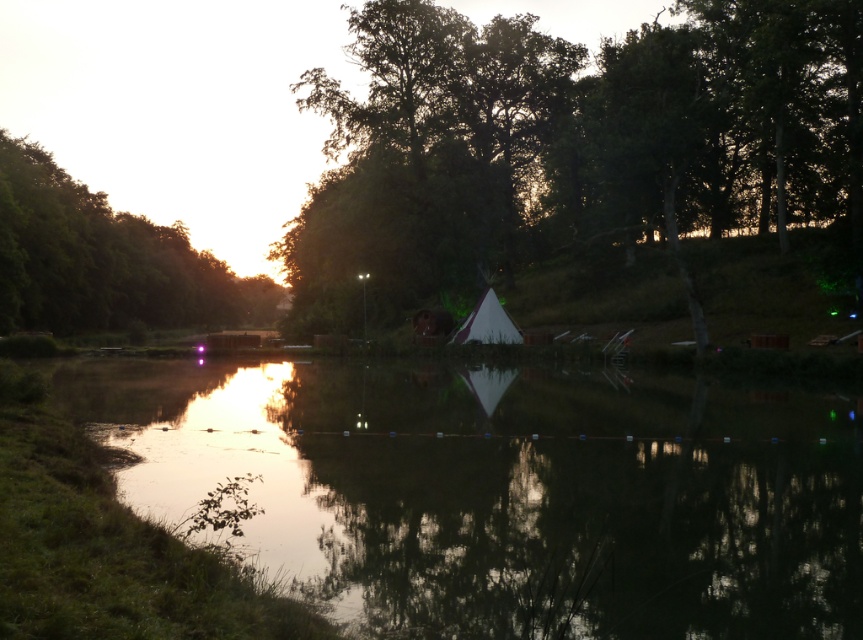
Is reflective glass water at center to the left of green leafy tree at upper left from the viewer's perspective?

In fact, reflective glass water at center is to the right of green leafy tree at upper left.

Looking at this image, can you confirm if reflective glass water at center is bigger than green leafy tree at upper left?

No, reflective glass water at center is not bigger than green leafy tree at upper left.

Is point (281, 481) positioned before point (213, 260)?

That is True.

Identify the location of reflective glass water at center. The image size is (863, 640). (501, 492).

Does reflective glass water at center have a lesser width compared to green leafy tree at center?

Correct, reflective glass water at center's width is less than green leafy tree at center's.

Find the location of a particular element. The width and height of the screenshot is (863, 640). reflective glass water at center is located at coordinates (501, 492).

Image resolution: width=863 pixels, height=640 pixels. What do you see at coordinates (501, 492) in the screenshot?
I see `reflective glass water at center` at bounding box center [501, 492].

Find the location of a particular element. Image resolution: width=863 pixels, height=640 pixels. reflective glass water at center is located at coordinates (501, 492).

Measure the distance between green leafy tree at center and green leafy tree at upper left.

They are 43.66 meters apart.

Between green leafy tree at center and green leafy tree at upper left, which one is positioned higher?

green leafy tree at center

The height and width of the screenshot is (640, 863). Describe the element at coordinates (572, 145) in the screenshot. I see `green leafy tree at center` at that location.

Identify the location of green leafy tree at center. The width and height of the screenshot is (863, 640). (572, 145).